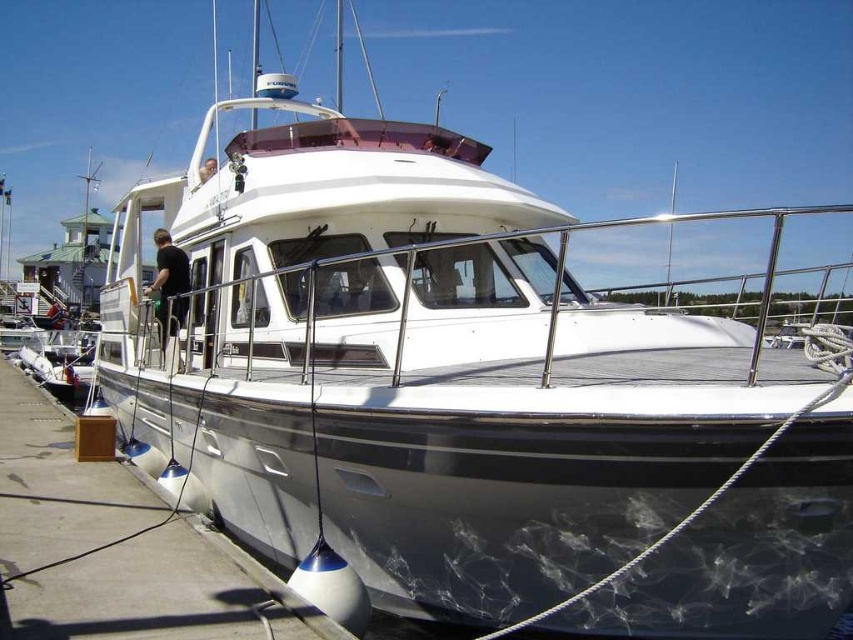
You are standing on the yacht and want to disembark onto the white glossy dock at lower center. Based on its position, can you estimate whether the dock is directly in front of you or to your side?

The white glossy dock at lower center is located at point coordinates, so it is positioned directly in front of you.

You are a photographer standing on the dock and want to take a picture of the black matte shirt at center. Based on the coordinates given, where should you aim your camera to capture the shirt in the frame?

The black matte shirt at center is located at coordinates point (x=169, y=285), so aim your camera towards that point to capture it in the frame.